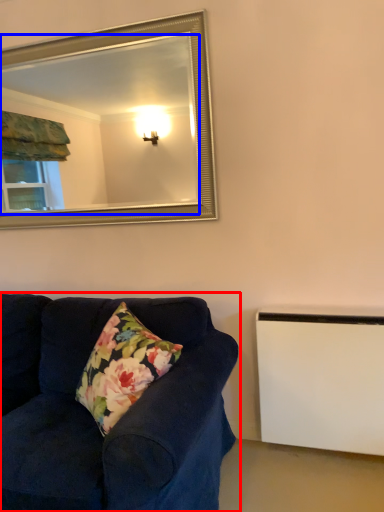
Question: Which point is closer to the camera, studio couch (highlighted by a red box) or mirror (highlighted by a blue box)?

Choices:
 (A) studio couch
 (B) mirror

Answer: (A)